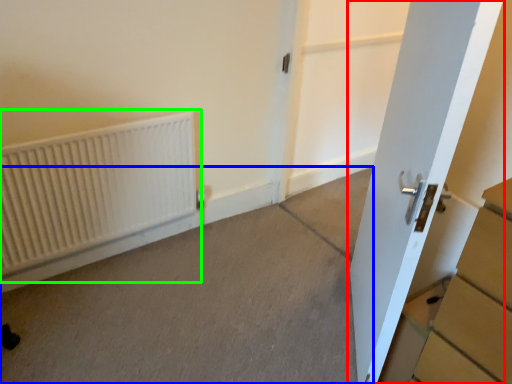
Question: Based on their relative distances, which object is nearer to door (highlighted by a red box)? Choose from concrete (highlighted by a blue box) and radiator (highlighted by a green box).

Choices:
 (A) concrete
 (B) radiator

Answer: (A)